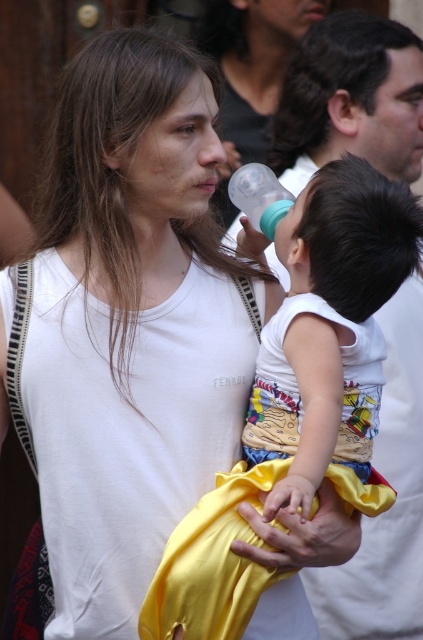
Question: Is brownhair at center bigger than dark brown hair at upper center?

Choices:
 (A) yes
 (B) no

Answer: (A)

Question: Which object is the closest to the dark brown hair at upper center?

Choices:
 (A) brownhair at center
 (B) smooth white shirt at center

Answer: (B)

Question: Among these objects, which one is farthest from the camera?

Choices:
 (A) brownhair at center
 (B) transparent plastic bottle at center
 (C) dark brown hair at upper center

Answer: (C)

Question: Is the position of smooth white shirt at center less distant than that of transparent plastic bottle at center?

Choices:
 (A) no
 (B) yes

Answer: (A)

Question: Where is smooth white shirt at center located in relation to brownhair at center in the image?

Choices:
 (A) above
 (B) below

Answer: (A)

Question: Estimate the real-world distances between objects in this image. Which object is closer to the brownhair at center?

Choices:
 (A) smooth white shirt at center
 (B) transparent plastic bottle at center
 (C) dark brown hair at upper center

Answer: (B)